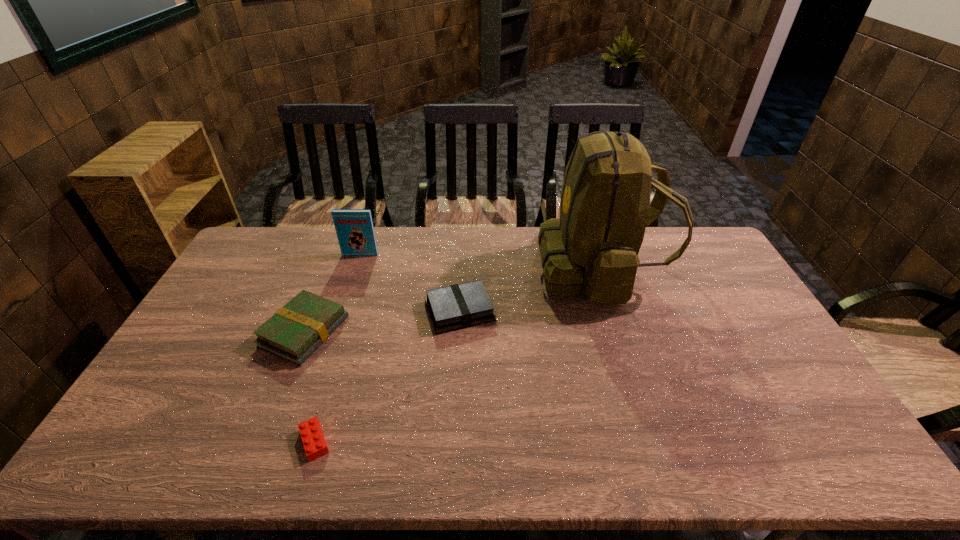
You are a GUI agent. You are given a task and a screenshot of the screen. Output one action in this format:
    pyautogui.click(x=<x>, y=<y>)
    Task: Click on the rightmost object
    This screenshot has height=540, width=960.
    Given the screenshot: What is the action you would take?
    pyautogui.click(x=593, y=247)

The height and width of the screenshot is (540, 960). Find the location of `the tallest object`. the tallest object is located at coordinates (593, 247).

The width and height of the screenshot is (960, 540). What are the coordinates of `the farthest book` in the screenshot? It's located at (354, 227).

The width and height of the screenshot is (960, 540). Find the location of `the tallest book`. the tallest book is located at coordinates (354, 227).

The height and width of the screenshot is (540, 960). I want to click on the rightmost book, so click(458, 306).

The image size is (960, 540). What are the coordinates of `Lego` in the screenshot? It's located at (315, 446).

The width and height of the screenshot is (960, 540). I want to click on the shortest object, so 315,446.

What are the coordinates of `vacant region located 0.300m on the front-facing side of the rightmost object` in the screenshot? It's located at (453, 268).

Find the location of a particular element. vacant region located on the front-facing side of the rightmost object is located at coordinates (492, 268).

This screenshot has height=540, width=960. I want to click on vacant space located on the front-facing side of the rightmost object, so click(x=484, y=268).